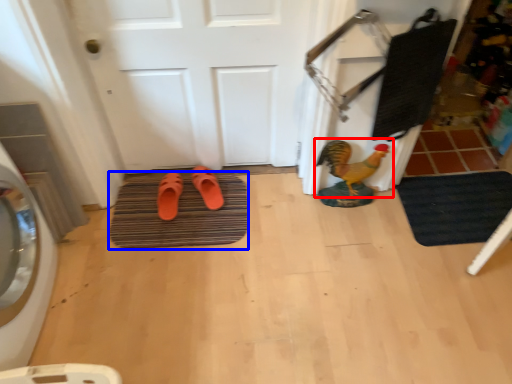
Question: Which object appears farthest to the camera in this image, chicken (highlighted by a red box) or bath mat (highlighted by a blue box)?

Choices:
 (A) chicken
 (B) bath mat

Answer: (B)